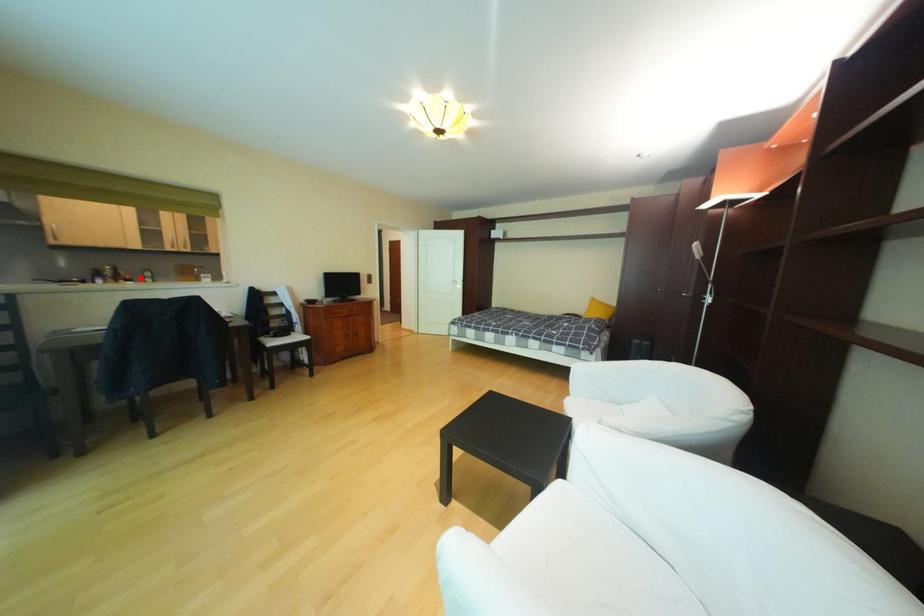
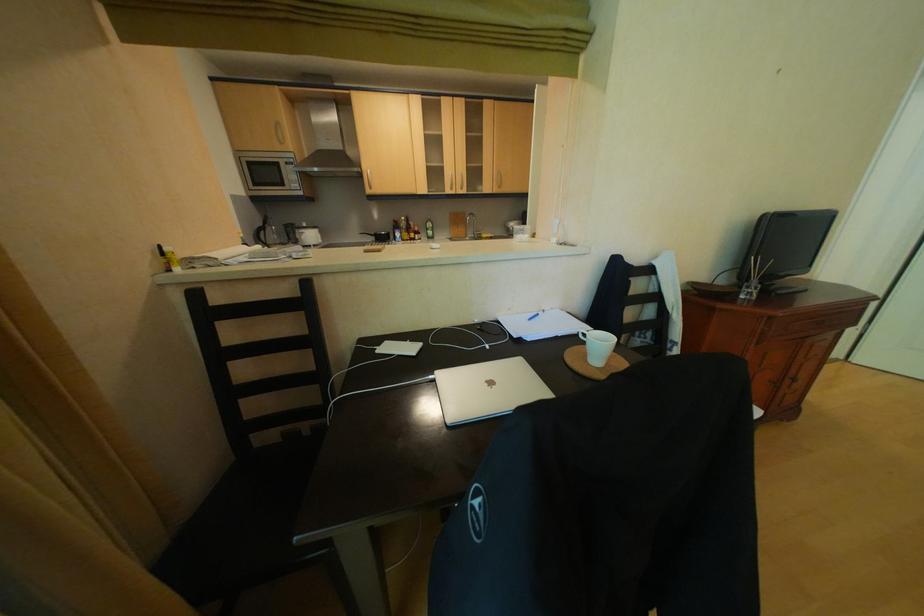
Question: I am providing you with two images of the same scene from different viewpoints. A red point is marked on the first image. Can you still see the location of the red point in image 2?

Choices:
 (A) Yes
 (B) No

Answer: (A)